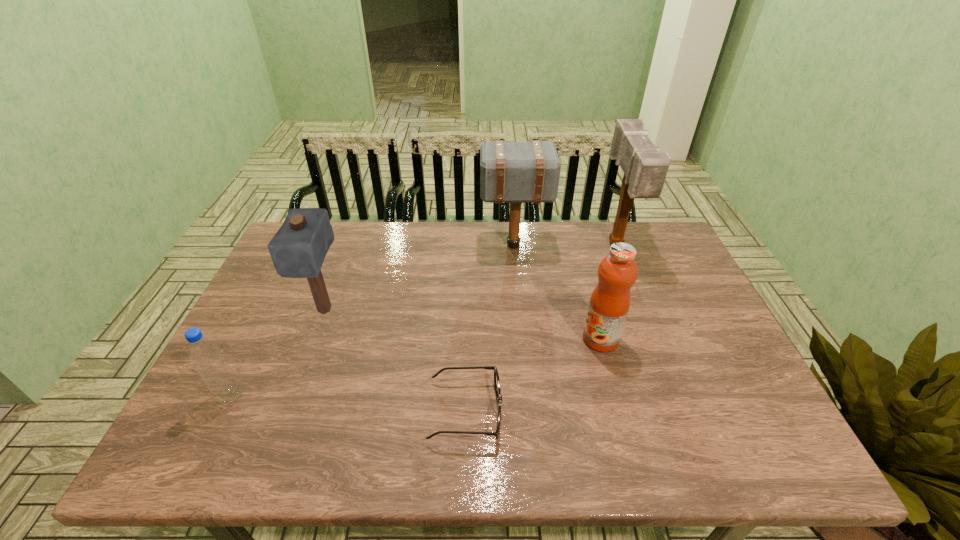
Locate an element on the screen. the rightmost mallet is located at coordinates (645, 169).

Image resolution: width=960 pixels, height=540 pixels. I want to click on the second mallet from left to right, so click(515, 172).

This screenshot has width=960, height=540. I want to click on the leftmost mallet, so click(298, 249).

In order to click on the second object from left to right in this screenshot , I will do `click(298, 249)`.

At what (x,y) coordinates should I click in order to perform the action: click on fruit juice. Please return your answer as a coordinate pair (x, y). Looking at the image, I should click on 617,272.

Find the location of a particular element. The height and width of the screenshot is (540, 960). water bottle is located at coordinates (206, 356).

The height and width of the screenshot is (540, 960). I want to click on the second shortest object, so click(206, 356).

Where is `spectacles`? This screenshot has height=540, width=960. spectacles is located at coordinates (496, 376).

Find the location of `free location located 0.400m on the left of the rightmost object`. free location located 0.400m on the left of the rightmost object is located at coordinates (483, 246).

Find the location of a particular element. This screenshot has height=540, width=960. vacant space located on the striking surface of the second mallet from left to right is located at coordinates (438, 245).